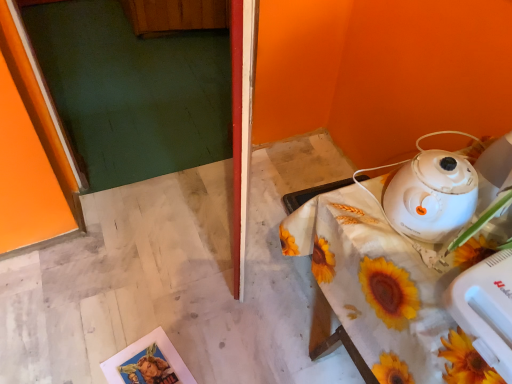
Question: Does white fabric-covered table at lower right appear on the right side of white plastic mixer at lower right?

Choices:
 (A) no
 (B) yes

Answer: (B)

Question: Can you confirm if white fabric-covered table at lower right is thinner than white plastic mixer at lower right?

Choices:
 (A) no
 (B) yes

Answer: (A)

Question: Can you confirm if white fabric-covered table at lower right is bigger than white plastic mixer at lower right?

Choices:
 (A) no
 (B) yes

Answer: (B)

Question: Is white fabric-covered table at lower right shorter than white plastic mixer at lower right?

Choices:
 (A) no
 (B) yes

Answer: (A)

Question: Is white fabric-covered table at lower right far away from white plastic mixer at lower right?

Choices:
 (A) yes
 (B) no

Answer: (B)

Question: Is white fabric-covered table at lower right not inside white plastic mixer at lower right?

Choices:
 (A) no
 (B) yes

Answer: (B)

Question: Is white glossy kettle at upper right shorter than white fabric-covered table at lower right?

Choices:
 (A) no
 (B) yes

Answer: (B)

Question: Is white glossy kettle at upper right to the left of white fabric-covered table at lower right from the viewer's perspective?

Choices:
 (A) yes
 (B) no

Answer: (A)

Question: Does white glossy kettle at upper right have a greater width compared to white fabric-covered table at lower right?

Choices:
 (A) no
 (B) yes

Answer: (A)

Question: From a real-world perspective, is white glossy kettle at upper right below white fabric-covered table at lower right?

Choices:
 (A) no
 (B) yes

Answer: (A)

Question: Can white fabric-covered table at lower right be found inside white glossy kettle at upper right?

Choices:
 (A) no
 (B) yes

Answer: (A)

Question: From a real-world perspective, is white glossy kettle at upper right on white fabric-covered table at lower right?

Choices:
 (A) yes
 (B) no

Answer: (A)

Question: Considering the relative sizes of white glossy kettle at upper right and white plastic mixer at lower right in the image provided, is white glossy kettle at upper right thinner than white plastic mixer at lower right?

Choices:
 (A) no
 (B) yes

Answer: (B)